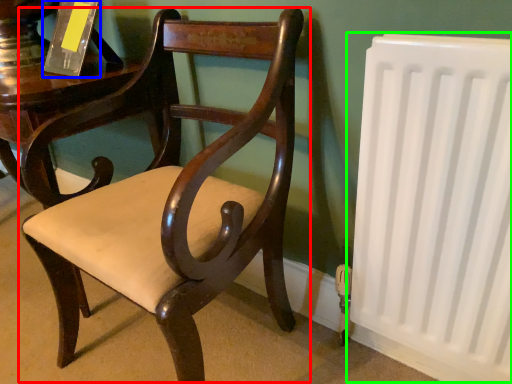
Question: Based on their relative distances, which object is farther from chair (highlighted by a red box)? Choose from paperback book (highlighted by a blue box) and radiator (highlighted by a green box).

Choices:
 (A) paperback book
 (B) radiator

Answer: (A)